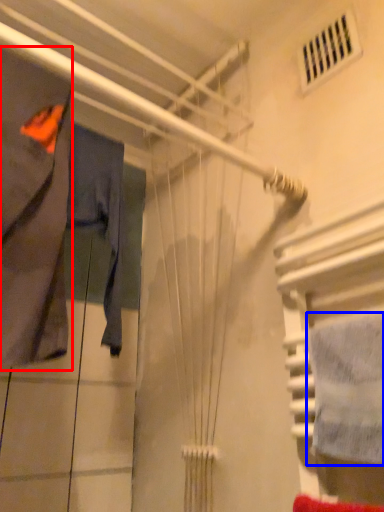
Question: Among these objects, which one is nearest to the camera, clothing (highlighted by a red box) or towel (highlighted by a blue box)?

Choices:
 (A) clothing
 (B) towel

Answer: (B)